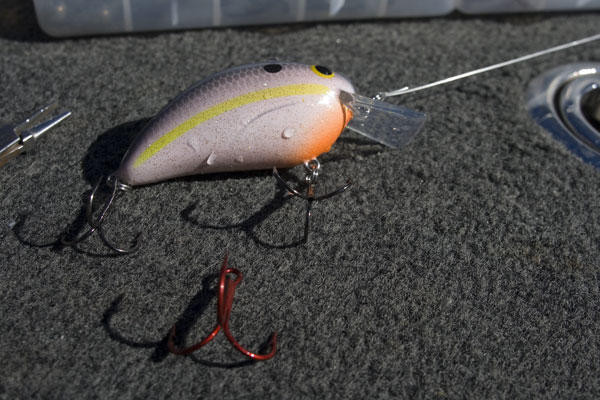
At what (x,y) coordinates should I click in order to perform the action: click on carpet. Please return your answer as a coordinate pair (x, y). The image size is (600, 400). Looking at the image, I should click on (415, 292).